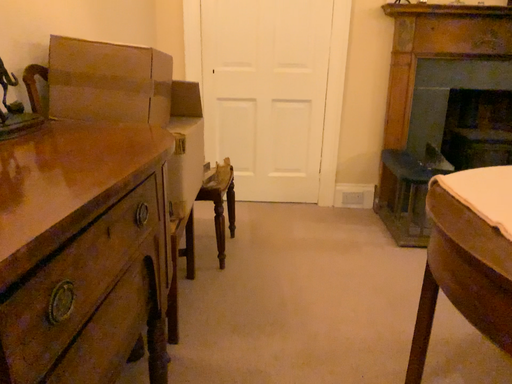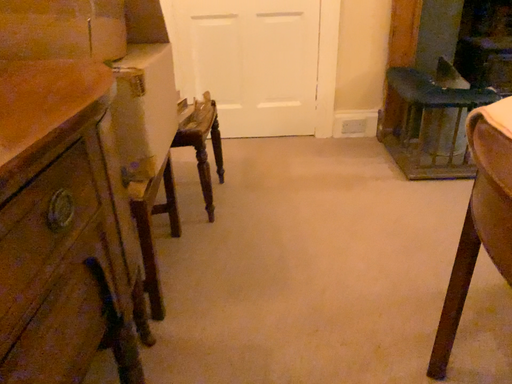
Question: How did the camera likely rotate when shooting the video?

Choices:
 (A) rotated downward
 (B) rotated upward

Answer: (A)